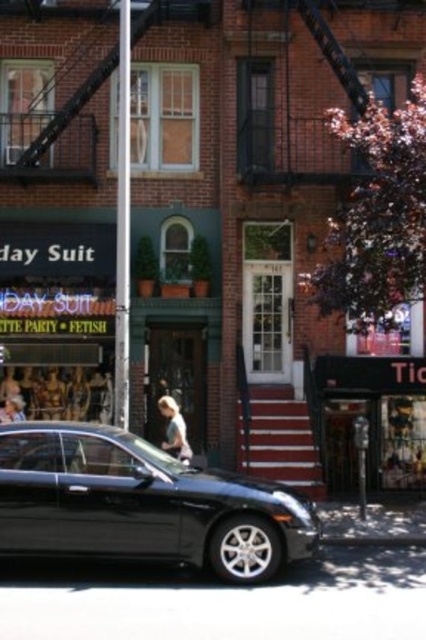
Which is behind, point (377, 467) or point (344, 544)?

The point (377, 467) is more distant.

Is point (328, 428) less distant than point (408, 540)?

No, it is not.

Does point (322, 426) lie in front of point (373, 536)?

No, it is not.

At what (x,y) coordinates should I click in order to perform the action: click on black matte sign at lower right. Please return your answer as a coordinate pair (x, y). Image resolution: width=426 pixels, height=640 pixels. Looking at the image, I should click on (368, 420).

Looking at this image, does black matte sign at lower right have a lesser width compared to light brown hair at center?

Incorrect, black matte sign at lower right's width is not less than light brown hair at center's.

Which is below, black matte sign at lower right or light brown hair at center?

black matte sign at lower right is below.

Between point (336, 428) and point (172, 444), which one is positioned behind?

The point (336, 428) is more distant.

The width and height of the screenshot is (426, 640). Identify the location of black matte sign at lower right. (368, 420).

Who is positioned more to the left, shiny black sedan at lower left or black matte sign at lower right?

shiny black sedan at lower left

Is point (95, 516) positioned in front of point (408, 426)?

Yes, it is in front of point (408, 426).

The height and width of the screenshot is (640, 426). In order to click on shiny black sedan at lower left in this screenshot , I will do `click(141, 504)`.